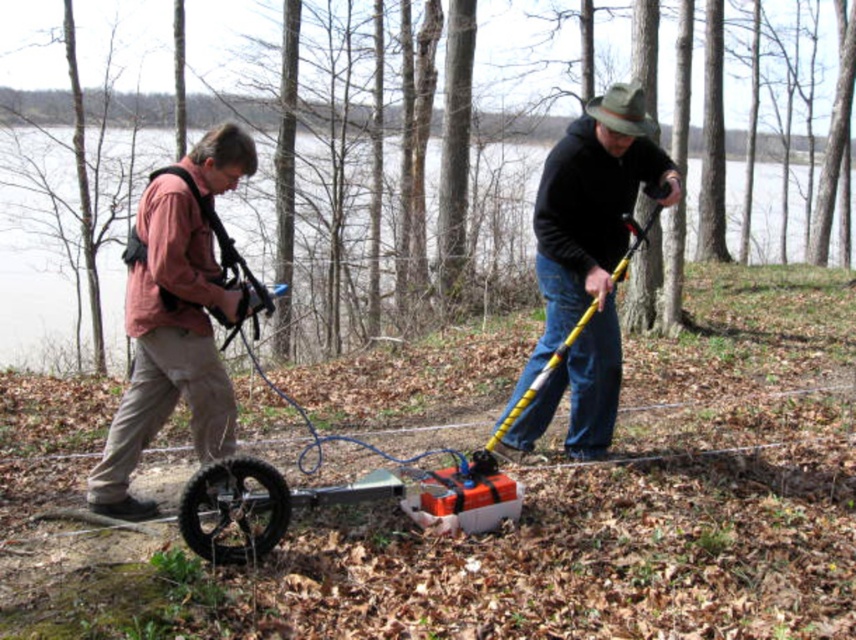
You are a safety inspector assessing the scene. You notice the matte pink shirt at center and the black matte pole at center. Which object is narrower in width?

The matte pink shirt at center is narrower in width compared to the black matte pole at center.

You are a park ranger trying to locate a missing hiker in the wooded area. You see a matte pink shirt at center and a black matte pole at center. Which object is closer to your left side?

The matte pink shirt at center is closer to your left side because it is positioned to the left of the black matte pole at center.